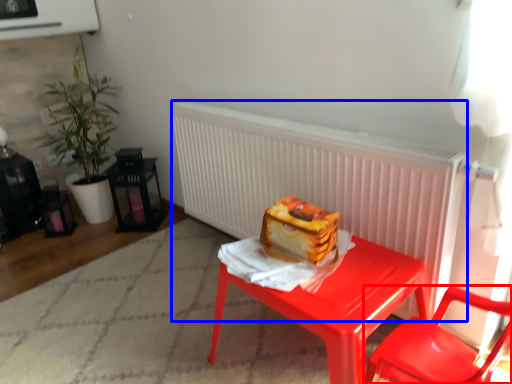
Question: Which of the following is the closest to the observer, chair (highlighted by a red box) or radiator (highlighted by a blue box)?

Choices:
 (A) chair
 (B) radiator

Answer: (A)